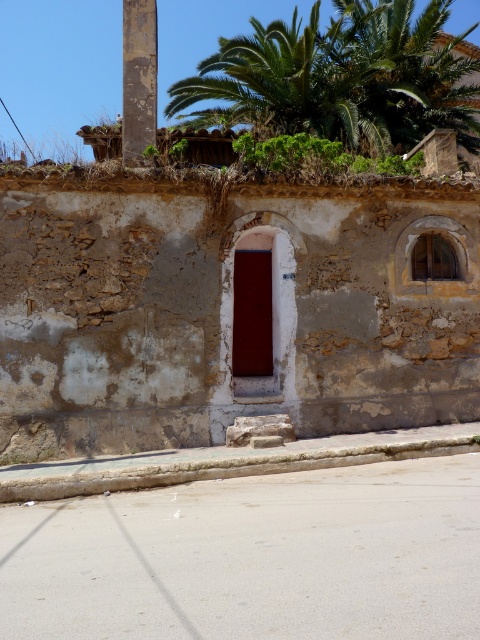
You are standing in front of the stone wall and looking up. You see a rusty metal pole at upper left and a green leafy plant at upper center. Which object is positioned more to the left side?

The rusty metal pole at upper left is positioned more to the left side than the green leafy plant at upper center.